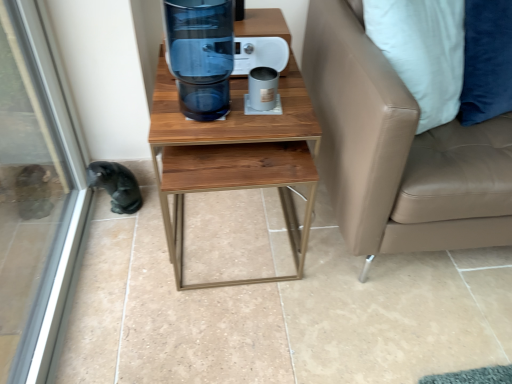
Where is `vacant area that lies to the right of transparent glass water cooler at center`? The height and width of the screenshot is (384, 512). vacant area that lies to the right of transparent glass water cooler at center is located at coordinates (262, 115).